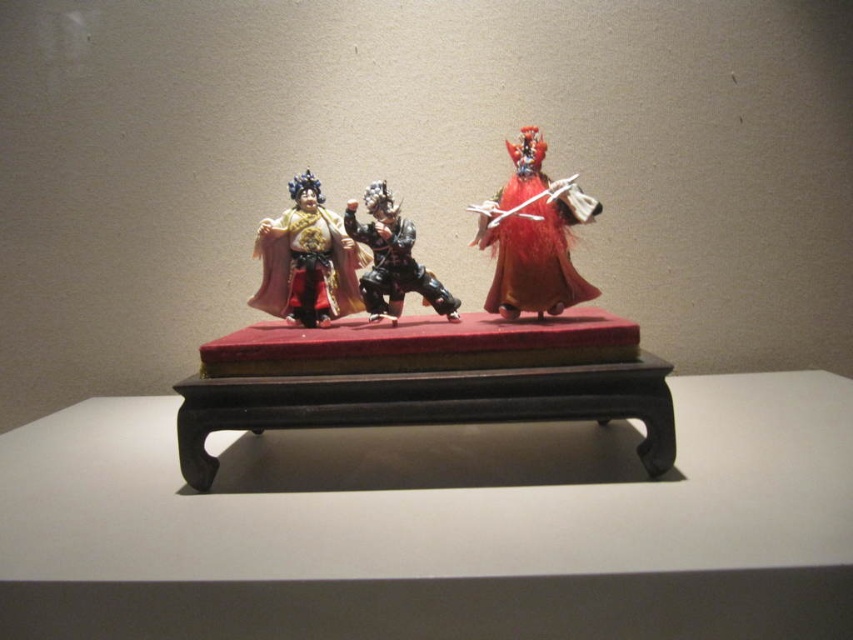
Question: Does velvet-like red figure at center appear under matte gold fabric at center?

Choices:
 (A) yes
 (B) no

Answer: (B)

Question: Which point is farther from the camera taking this photo?

Choices:
 (A) (380, 252)
 (B) (838, 531)
 (C) (393, 374)

Answer: (A)

Question: Can you confirm if dark brown wooden table at center is positioned below wooden table at center?

Choices:
 (A) yes
 (B) no

Answer: (A)

Question: Which point is farther to the camera?

Choices:
 (A) matte gold fabric at center
 (B) dark brown wooden table at center
 (C) velvet-like red figure at center

Answer: (A)

Question: Which point is closer to the camera?

Choices:
 (A) (357, 204)
 (B) (572, 355)

Answer: (B)

Question: Does dark brown wooden table at center have a greater width compared to velvet-like red figure at center?

Choices:
 (A) yes
 (B) no

Answer: (A)